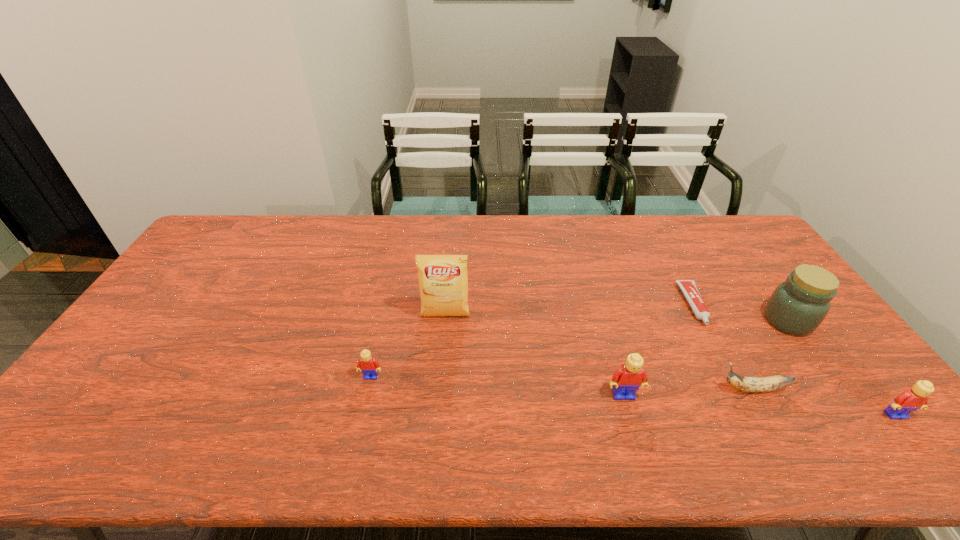
This screenshot has height=540, width=960. Find the location of `the farthest Lego`. the farthest Lego is located at coordinates (369, 366).

The height and width of the screenshot is (540, 960). What are the coordinates of `the leftmost Lego` in the screenshot? It's located at (369, 366).

The width and height of the screenshot is (960, 540). I want to click on the fifth shortest object, so click(x=626, y=380).

This screenshot has height=540, width=960. What are the coordinates of `the third object from left to right` in the screenshot? It's located at (626, 380).

In order to click on the nearest Lego in this screenshot , I will do `click(910, 400)`.

The width and height of the screenshot is (960, 540). I want to click on the rightmost Lego, so click(x=910, y=400).

Locate an element on the screen. This screenshot has width=960, height=540. toothpaste is located at coordinates (688, 287).

Where is `crisp (potato chip)`? The image size is (960, 540). crisp (potato chip) is located at coordinates (443, 279).

Identify the location of the tallest object. Image resolution: width=960 pixels, height=540 pixels. (443, 279).

You are a GUI agent. You are given a task and a screenshot of the screen. Output one action in this format:
    pyautogui.click(x=<x>, y=<y>)
    Task: Click on the jar
    Image resolution: width=960 pixels, height=540 pixels.
    Given the screenshot: What is the action you would take?
    pyautogui.click(x=797, y=307)